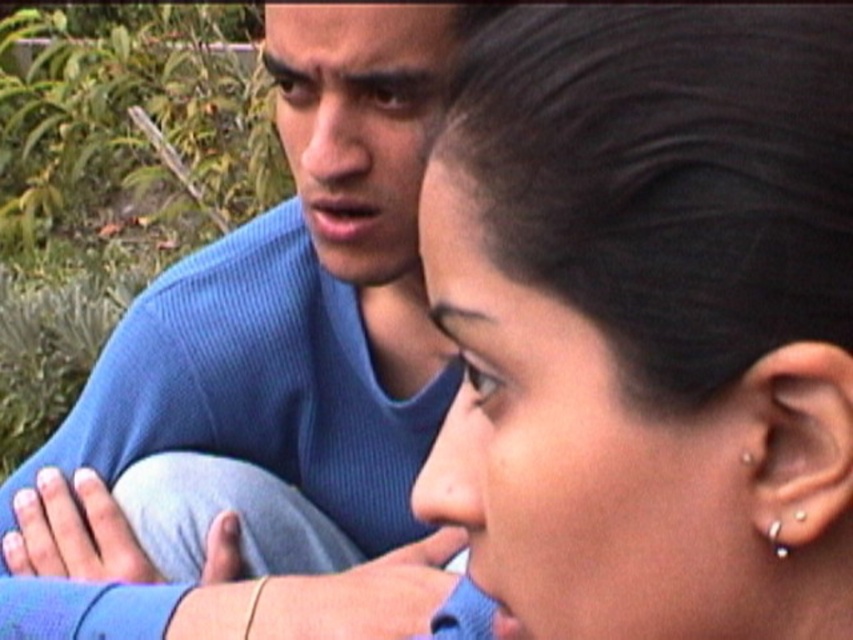
Can you confirm if black hair at upper center is positioned above matte blue forehead at upper center?

Actually, black hair at upper center is below matte blue forehead at upper center.

Which of these two, black hair at upper center or matte blue forehead at upper center, stands taller?

Standing taller between the two is black hair at upper center.

Is point (834, 320) in front of point (274, 51)?

Yes, point (834, 320) is closer to viewer.

This screenshot has height=640, width=853. I want to click on black hair at upper center, so click(648, 320).

Is matte blue forehead at upper center below silver metallic earring at ear?

No, matte blue forehead at upper center is not below silver metallic earring at ear.

Is matte blue forehead at upper center smaller than silver metallic earring at ear?

No.

Does point (445, 36) lie behind point (773, 547)?

Yes.

Where is `matte blue forehead at upper center`? The width and height of the screenshot is (853, 640). matte blue forehead at upper center is located at coordinates (357, 38).

Looking at this image, which is more to the left, black hair at upper center or silver metallic earring at ear?

Positioned to the left is black hair at upper center.

This screenshot has width=853, height=640. Identify the location of black hair at upper center. (648, 320).